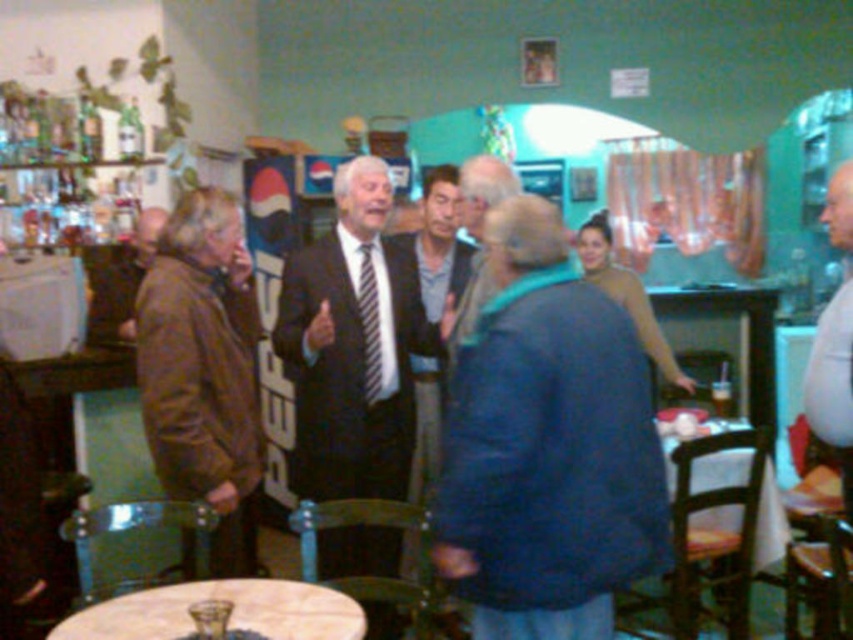
Can you confirm if white marble table at center is smaller than brown leather jacket at left?

Yes.

Between white marble table at center and brown leather jacket at left, which one appears on the left side from the viewer's perspective?

From the viewer's perspective, brown leather jacket at left appears more on the left side.

Locate an element on the screen. Image resolution: width=853 pixels, height=640 pixels. white marble table at center is located at coordinates (229, 616).

Can you confirm if blue woolen sweater at center is positioned to the left of white cotton shirt at right?

Indeed, blue woolen sweater at center is positioned on the left side of white cotton shirt at right.

Locate an element on the screen. blue woolen sweater at center is located at coordinates (547, 445).

Does blue woolen sweater at center appear over dark suit at center?

Yes.

Is point (506, 518) behind point (360, 291)?

No, (506, 518) is in front of (360, 291).

Is point (457, 456) farther from viewer compared to point (402, 314)?

No, it is in front of (402, 314).

Locate an element on the screen. The width and height of the screenshot is (853, 640). blue woolen sweater at center is located at coordinates (547, 445).